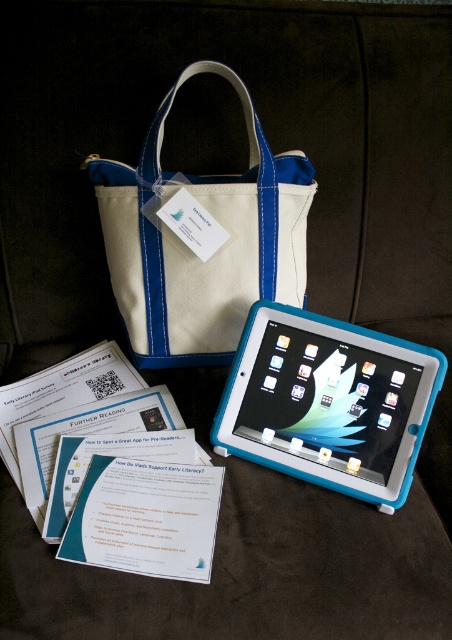
You are a delivery person who needs to place a 6.5 inch wide package between the white canvas tote at upper center and the blue rubberized tablet at center. Can the package fit in the space between them?

The distance between the white canvas tote at upper center and the blue rubberized tablet at center is 7.11 inches, so the 6.5 inch wide package can fit in the space between them since it is narrower than the available distance.

You are organizing items on a couch and need to place both the white canvas tote at upper center and the blue rubberized tablet at center. According to the arrangement shown, which item is positioned higher up?

The white canvas tote at upper center is positioned higher up than the blue rubberized tablet at center.

You are organizing items on a couch and need to place the white canvas tote at upper center and the blue rubberized tablet at center. According to the scene, which object is positioned to the left of the other?

The white canvas tote at upper center is to the left of the blue rubberized tablet at center.